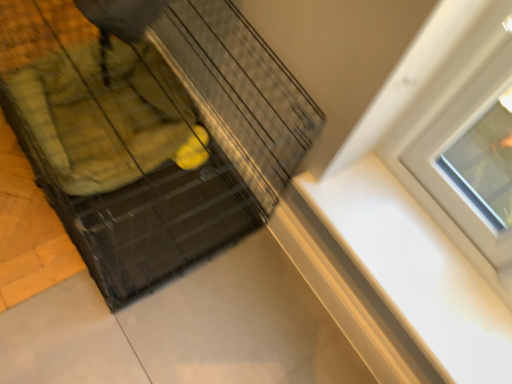
What do you see at coordinates (415, 272) in the screenshot? Image resolution: width=512 pixels, height=384 pixels. I see `white glossy window sill at upper right` at bounding box center [415, 272].

This screenshot has height=384, width=512. Find the location of `white glossy window sill at upper right`. white glossy window sill at upper right is located at coordinates (415, 272).

The image size is (512, 384). What do you see at coordinates (152, 133) in the screenshot?
I see `black wire baby carriage at center` at bounding box center [152, 133].

Find the location of `black wire baby carriage at center`. black wire baby carriage at center is located at coordinates (152, 133).

Where is `white glossy window sill at upper right`? The width and height of the screenshot is (512, 384). white glossy window sill at upper right is located at coordinates (415, 272).

Between black wire baby carriage at center and white glossy window sill at upper right, which one appears on the left side from the viewer's perspective?

black wire baby carriage at center is more to the left.

Which object is further away from the camera, black wire baby carriage at center or white glossy window sill at upper right?

white glossy window sill at upper right is behind.

Which is nearer, (201, 155) or (465, 326)?

The point (465, 326) is closer to the camera.

From the image's perspective, which one is positioned lower, black wire baby carriage at center or white glossy window sill at upper right?

white glossy window sill at upper right.

From a real-world perspective, is black wire baby carriage at center on white glossy window sill at upper right?

No, from a real-world perspective, black wire baby carriage at center is not above white glossy window sill at upper right.

Can you confirm if black wire baby carriage at center is wider than white glossy window sill at upper right?

Correct, the width of black wire baby carriage at center exceeds that of white glossy window sill at upper right.

Between black wire baby carriage at center and white glossy window sill at upper right, which one has less height?

With less height is white glossy window sill at upper right.

Between black wire baby carriage at center and white glossy window sill at upper right, which one has smaller size?

With smaller size is white glossy window sill at upper right.

Can we say black wire baby carriage at center lies outside white glossy window sill at upper right?

Yes, black wire baby carriage at center is not within white glossy window sill at upper right.

Are black wire baby carriage at center and white glossy window sill at upper right beside each other?

No, black wire baby carriage at center is not next to white glossy window sill at upper right.

Could you tell me if black wire baby carriage at center is turned towards white glossy window sill at upper right?

No, black wire baby carriage at center does not turn towards white glossy window sill at upper right.

What's the angular difference between black wire baby carriage at center and white glossy window sill at upper right's facing directions?

The facing directions of black wire baby carriage at center and white glossy window sill at upper right are 0.609 degrees apart.

Measure the distance between black wire baby carriage at center and white glossy window sill at upper right.

black wire baby carriage at center is 21.58 inches away from white glossy window sill at upper right.

At what (x,y) coordinates should I click in order to perform the action: click on window sill to the right of black wire baby carriage at center. Please return your answer as a coordinate pair (x, y). The image size is (512, 384). Looking at the image, I should click on (415, 272).

Can you confirm if white glossy window sill at upper right is positioned to the left of black wire baby carriage at center?

Incorrect, white glossy window sill at upper right is not on the left side of black wire baby carriage at center.

Is the depth of white glossy window sill at upper right greater than that of black wire baby carriage at center?

Yes.

Is point (424, 334) behind point (41, 143)?

No, (424, 334) is in front of (41, 143).

From the image's perspective, is white glossy window sill at upper right beneath black wire baby carriage at center?

Yes, from the image's perspective, white glossy window sill at upper right is beneath black wire baby carriage at center.

From a real-world perspective, is white glossy window sill at upper right over black wire baby carriage at center?

Yes.

Is white glossy window sill at upper right wider or thinner than black wire baby carriage at center?

Considering their sizes, white glossy window sill at upper right looks slimmer than black wire baby carriage at center.

Who is shorter, white glossy window sill at upper right or black wire baby carriage at center?

Standing shorter between the two is white glossy window sill at upper right.

Considering the sizes of objects white glossy window sill at upper right and black wire baby carriage at center in the image provided, who is smaller, white glossy window sill at upper right or black wire baby carriage at center?

white glossy window sill at upper right is smaller.

Which is correct: white glossy window sill at upper right is inside black wire baby carriage at center, or outside of it?

white glossy window sill at upper right is spatially situated outside black wire baby carriage at center.

Would you say white glossy window sill at upper right is a long distance from black wire baby carriage at center?

That's not correct — white glossy window sill at upper right is a little close to black wire baby carriage at center.

Does white glossy window sill at upper right turn towards black wire baby carriage at center?

No, white glossy window sill at upper right is not oriented towards black wire baby carriage at center.

How different are the orientations of white glossy window sill at upper right and black wire baby carriage at center in degrees?

0.609 degrees.

How much distance is there between white glossy window sill at upper right and black wire baby carriage at center?

white glossy window sill at upper right and black wire baby carriage at center are 21.58 inches apart.

Where is `window sill lying on the right of black wire baby carriage at center`? Image resolution: width=512 pixels, height=384 pixels. window sill lying on the right of black wire baby carriage at center is located at coordinates (415, 272).

Find the location of a particular element. The height and width of the screenshot is (384, 512). baby carriage in front of the white glossy window sill at upper right is located at coordinates (152, 133).

What are the coordinates of `baby carriage that is on the left side of white glossy window sill at upper right` in the screenshot? It's located at (152, 133).